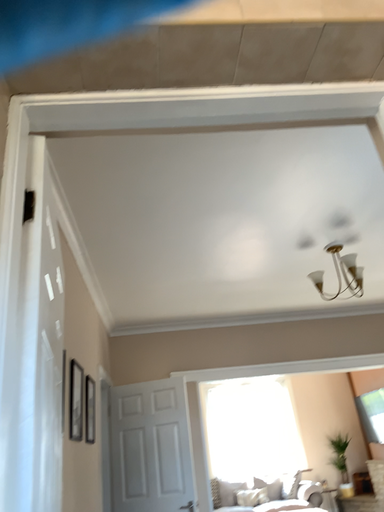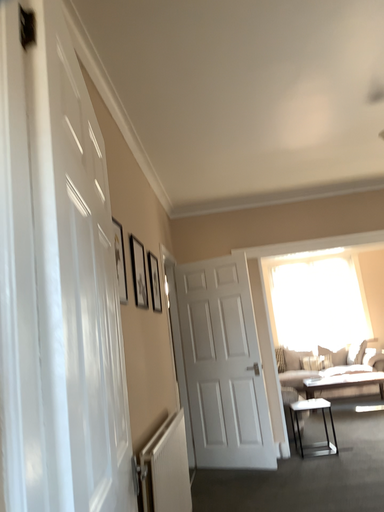
Question: Which way did the camera rotate in the video?

Choices:
 (A) rotated upward
 (B) rotated downward

Answer: (B)